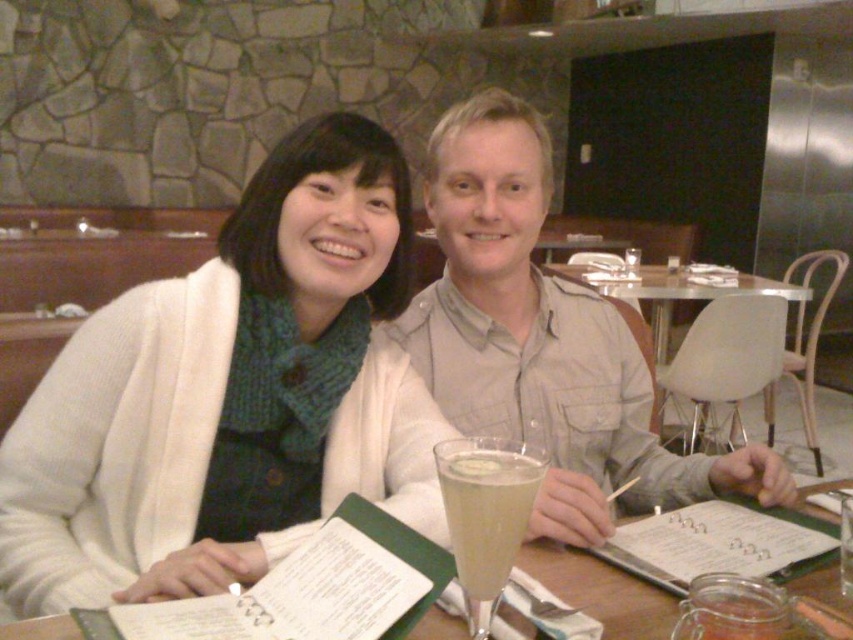
You are a photographer setting up a shot of the two people at the table. You want to ensure there is enough space between the white knit sweater at upper left and the clear glass table at center for your camera lens to focus properly. The minimum focusing distance for your lens is 16 inches. Will you need to adjust the camera position?

The white knit sweater at upper left and clear glass table at center are 15.99 inches apart, which is just below the minimum focusing distance of 16 inches. Therefore, you will need to adjust the camera position to ensure proper focus.

You are a photographer adjusting your camera to focus on two points in the scene. The first point is at coordinate point [503,544] and the second is at point [825,588]. Which point should you focus on first if you want to ensure the closest object is in sharp focus?

Point [503,544] is closer to the camera than point [825,588], so you should focus on point [503,544] first to ensure the closest object is in sharp focus.

You are designing a storage space and need to stack items vertically. You have a white knit sweater at upper left and a white plastic chair at center. Which item can be placed on top of the other without exceeding the storage area height limit?

The white knit sweater at upper left can be placed on top of the white plastic chair at center because it is thinner and will not exceed the height limit.